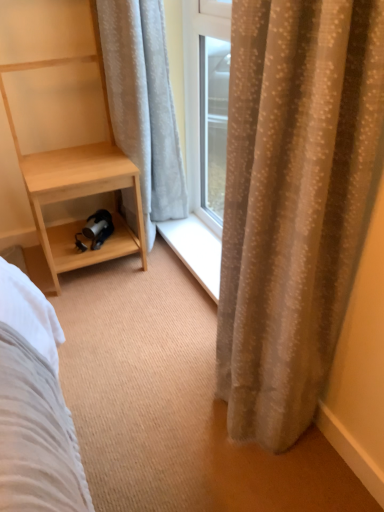
Locate an element on the screen. free spot in front of beige textured curtain at right, positioned as the 1th curtain in front-to-back order is located at coordinates (239, 477).